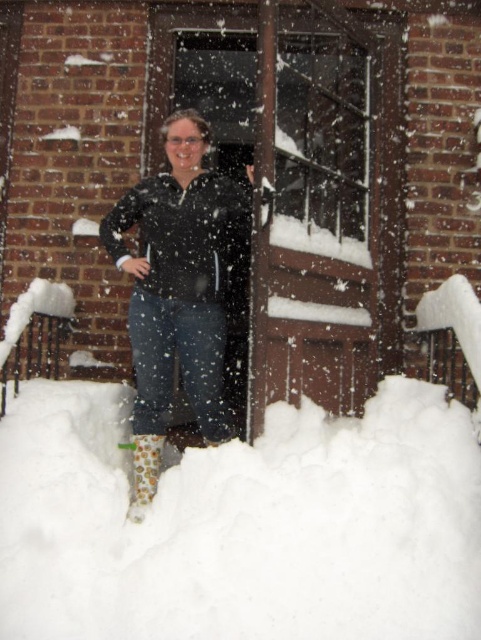
Is white fluffy snow at lower center wider than camouflage-patterned boot at lower left?

Indeed, white fluffy snow at lower center has a greater width compared to camouflage-patterned boot at lower left.

What do you see at coordinates (243, 525) in the screenshot? I see `white fluffy snow at lower center` at bounding box center [243, 525].

I want to click on white fluffy snow at lower center, so click(243, 525).

Find the location of a particular element. This screenshot has width=481, height=640. white fluffy snow at lower center is located at coordinates point(243,525).

From the picture: Between white fluffy snow at lower center and matte black jacket at center, which one has less height?

white fluffy snow at lower center

Does white fluffy snow at lower center have a lesser height compared to matte black jacket at center?

Indeed, white fluffy snow at lower center has a lesser height compared to matte black jacket at center.

Locate an element on the screen. The image size is (481, 640). white fluffy snow at lower center is located at coordinates (243, 525).

The image size is (481, 640). In order to click on matte black jacket at center in this screenshot , I will do `click(176, 292)`.

Who is positioned more to the left, matte black jacket at center or camouflage-patterned boot at lower left?

Positioned to the left is camouflage-patterned boot at lower left.

Does point (200, 172) come in front of point (134, 474)?

Yes, point (200, 172) is closer to viewer.

Identify the location of matte black jacket at center. This screenshot has height=640, width=481. (176, 292).